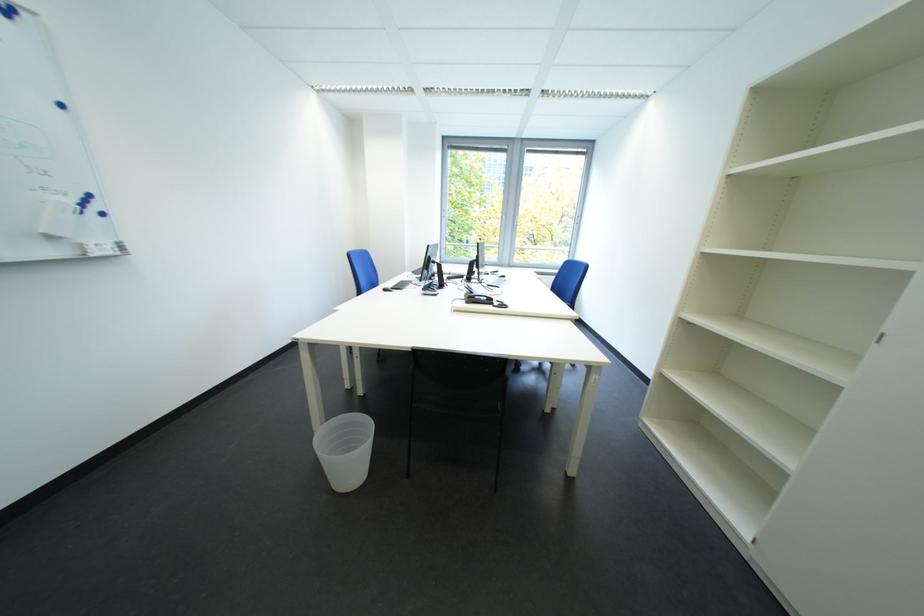
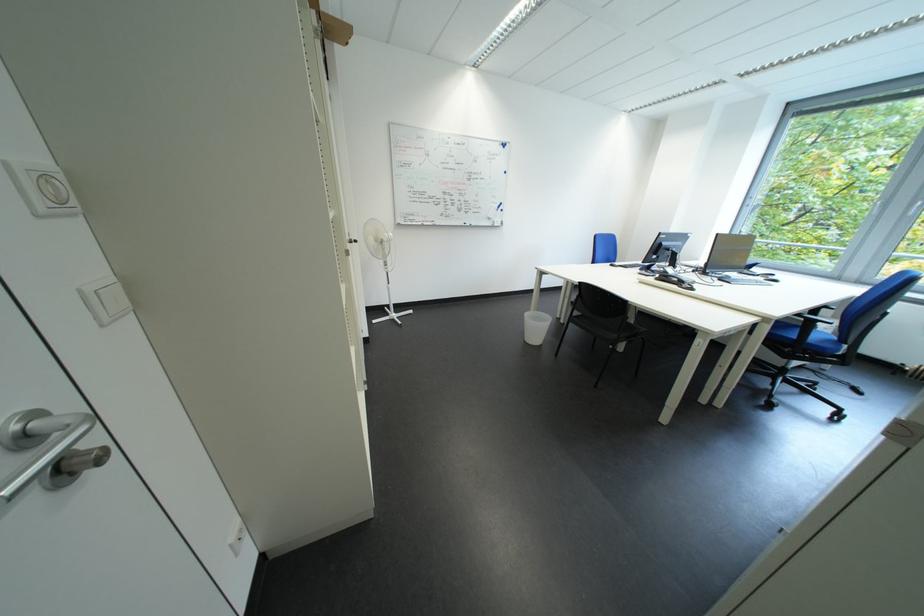
In the second image, find the point that corresponds to point 372,395 in the first image.

(575, 323)